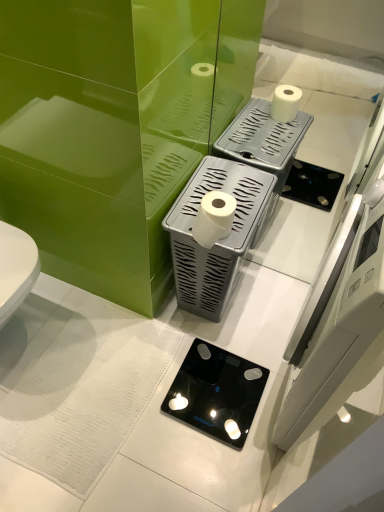
I want to click on unoccupied area in front of white plastic toilet paper holder at center, which is counted as the 2th appliance, starting from the bottom, so click(204, 352).